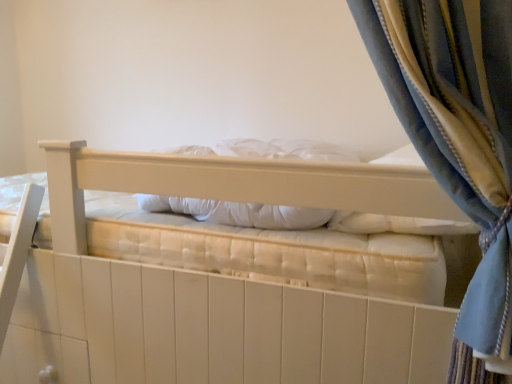
Locate an element on the screen. white quilted mattress at center is located at coordinates (229, 306).

What do you see at coordinates (229, 306) in the screenshot?
I see `white quilted mattress at center` at bounding box center [229, 306].

At what (x,y) coordinates should I click in order to perform the action: click on white soft pillow at center. Please return your answer as a coordinate pair (x, y). Looking at the image, I should click on (238, 212).

Image resolution: width=512 pixels, height=384 pixels. Describe the element at coordinates (238, 212) in the screenshot. I see `white soft pillow at center` at that location.

Identify the location of white quilted mattress at center. (229, 306).

In the scene shown: Which object is positioned more to the left, white quilted mattress at center or white soft pillow at center?

white quilted mattress at center.

Is the depth of white quilted mattress at center greater than that of white soft pillow at center?

No, it is not.

Between point (182, 322) and point (137, 197), which one is positioned behind?

Positioned behind is point (137, 197).

From the image's perspective, is white quilted mattress at center beneath white soft pillow at center?

Indeed, from the image's perspective, white quilted mattress at center is shown beneath white soft pillow at center.

From a real-world perspective, which is physically below, white quilted mattress at center or white soft pillow at center?

In real-world perspective, white quilted mattress at center is lower.

Which of these two, white quilted mattress at center or white soft pillow at center, is thinner?

white soft pillow at center is thinner.

From their relative heights in the image, would you say white quilted mattress at center is taller or shorter than white soft pillow at center?

In the image, white quilted mattress at center appears to be taller than white soft pillow at center.

Can you confirm if white quilted mattress at center is smaller than white soft pillow at center?

No.

Is white soft pillow at center inside white quilted mattress at center?

Indeed, white soft pillow at center is located within white quilted mattress at center.

Would you consider white quilted mattress at center to be distant from white soft pillow at center?

white quilted mattress at center is actually quite close to white soft pillow at center.

Is white quilted mattress at center turned away from white soft pillow at center?

No, white quilted mattress at center is not facing the opposite direction of white soft pillow at center.

Identify the location of pillow behind the white quilted mattress at center. This screenshot has height=384, width=512. (238, 212).

Is white soft pillow at center to the right of white quilted mattress at center from the viewer's perspective?

Yes, white soft pillow at center is to the right of white quilted mattress at center.

Is the depth of white soft pillow at center less than that of white quilted mattress at center?

No, the depth of white soft pillow at center is greater than that of white quilted mattress at center.

Is point (245, 207) positioned after point (263, 236)?

Yes.

From the image's perspective, between white soft pillow at center and white quilted mattress at center, which one is located above?

white soft pillow at center.

From a real-world perspective, is white soft pillow at center over white quilted mattress at center?

Yes, from a real-world perspective, white soft pillow at center is on top of white quilted mattress at center.

In the scene shown: Which object is wider, white soft pillow at center or white quilted mattress at center?

white quilted mattress at center is wider.

Does white soft pillow at center have a greater height compared to white quilted mattress at center?

In fact, white soft pillow at center may be shorter than white quilted mattress at center.

Is white soft pillow at center bigger than white quilted mattress at center?

Actually, white soft pillow at center might be smaller than white quilted mattress at center.

Is white quilted mattress at center surrounded by white soft pillow at center?

No, white soft pillow at center does not contain white quilted mattress at center.

Is white soft pillow at center not near white quilted mattress at center?

No, there isn't a large distance between white soft pillow at center and white quilted mattress at center.

Is white soft pillow at center looking in the opposite direction of white quilted mattress at center?

Yes, white soft pillow at center's orientation is away from white quilted mattress at center.

At what (x,y) coordinates should I click in order to perform the action: click on pillow located above the white quilted mattress at center (from the image's perspective). Please return your answer as a coordinate pair (x, y). This screenshot has height=384, width=512. Looking at the image, I should click on pos(238,212).

Locate an element on the screen. This screenshot has height=384, width=512. bed below the white soft pillow at center (from a real-world perspective) is located at coordinates (229, 306).

This screenshot has height=384, width=512. I want to click on pillow that appears above the white quilted mattress at center (from the image's perspective), so click(x=238, y=212).